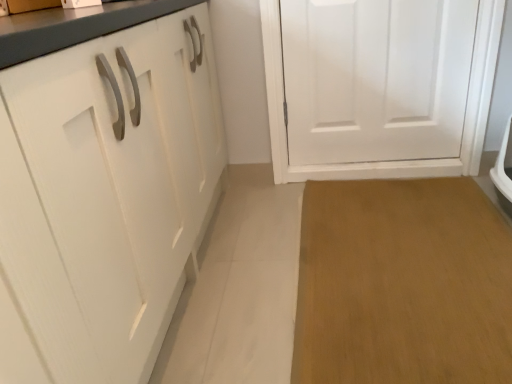
You are a GUI agent. You are given a task and a screenshot of the screen. Output one action in this format:
    pyautogui.click(x=<x>, y=<y>)
    Task: Click on the vacant area situated to the left side of brown wood floor at lower right
    The width and height of the screenshot is (512, 384).
    Given the screenshot: What is the action you would take?
    pyautogui.click(x=248, y=276)